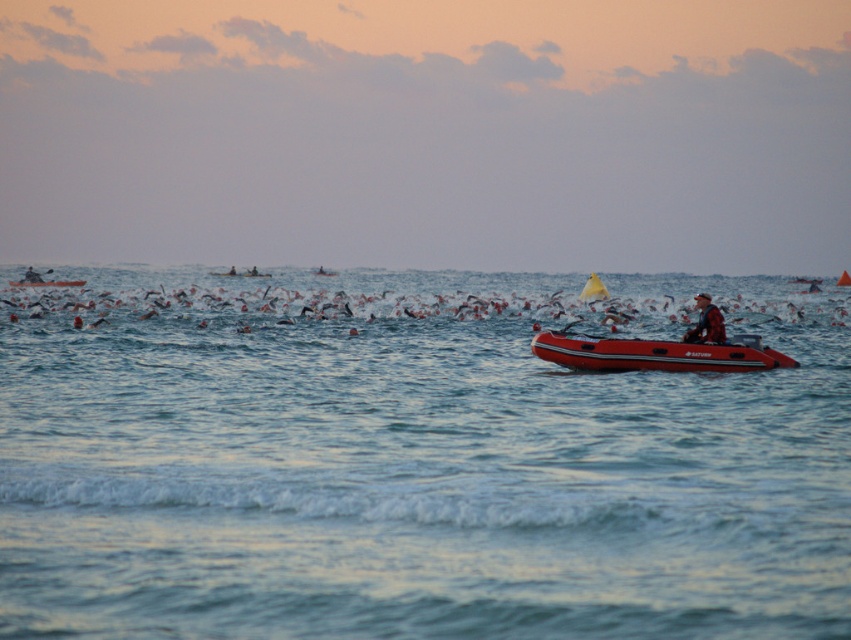
Which is behind, point (206, 604) or point (36, 284)?

Point (36, 284)

The image size is (851, 640). In order to click on blue water at center in this screenshot , I will do (414, 461).

Image resolution: width=851 pixels, height=640 pixels. What do you see at coordinates (706, 323) in the screenshot?
I see `red life jacket at center` at bounding box center [706, 323].

Who is higher up, red life jacket at center or rubber boat at left?

rubber boat at left is above.

Locate an element on the screen. The image size is (851, 640). red life jacket at center is located at coordinates (706, 323).

Identify the location of red life jacket at center. (706, 323).

At what (x,y) coordinates should I click in order to perform the action: click on blue water at center. Please return your answer as a coordinate pair (x, y). Looking at the image, I should click on (414, 461).

Is blue water at center smaller than rubberized red inflatable boat at right?

No.

Is point (144, 301) positioned before point (569, 348)?

No.

Identify the location of blue water at center. The height and width of the screenshot is (640, 851). (x=414, y=461).